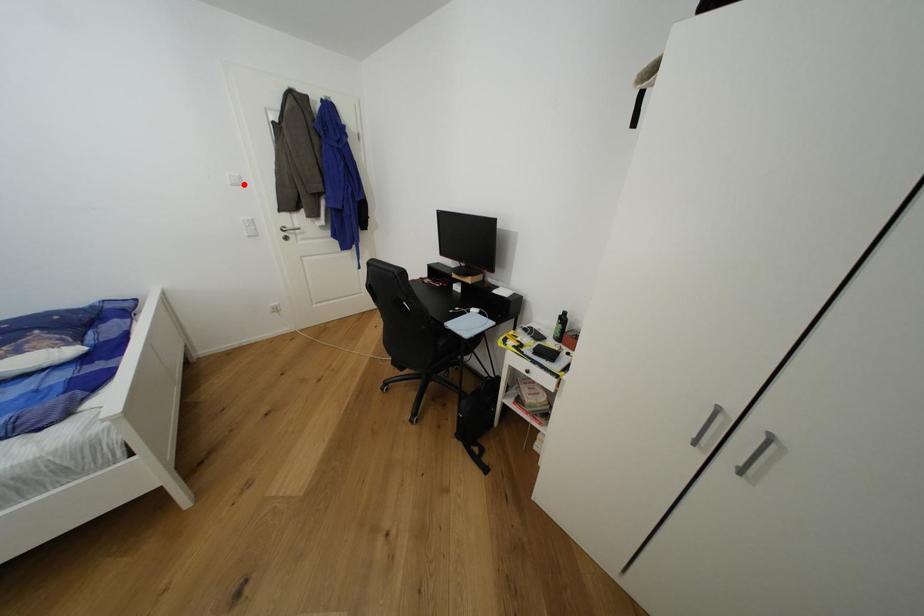
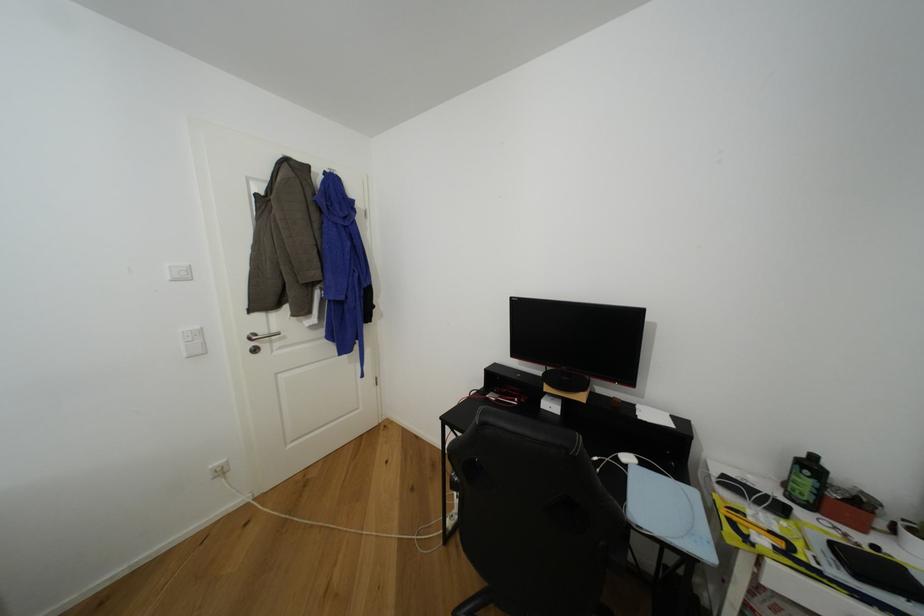
Question: I am providing you with two images of the same scene from different viewpoints. In image1, a red point is highlighted. Considering the same 3D point in image2, which of the following is correct?

Choices:
 (A) It is closer
 (B) It is farther

Answer: (B)